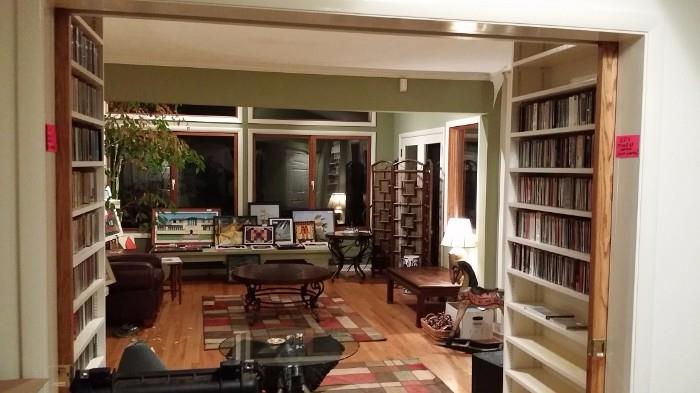
Identify the location of indoor plant. Image resolution: width=700 pixels, height=393 pixels. (119, 140).